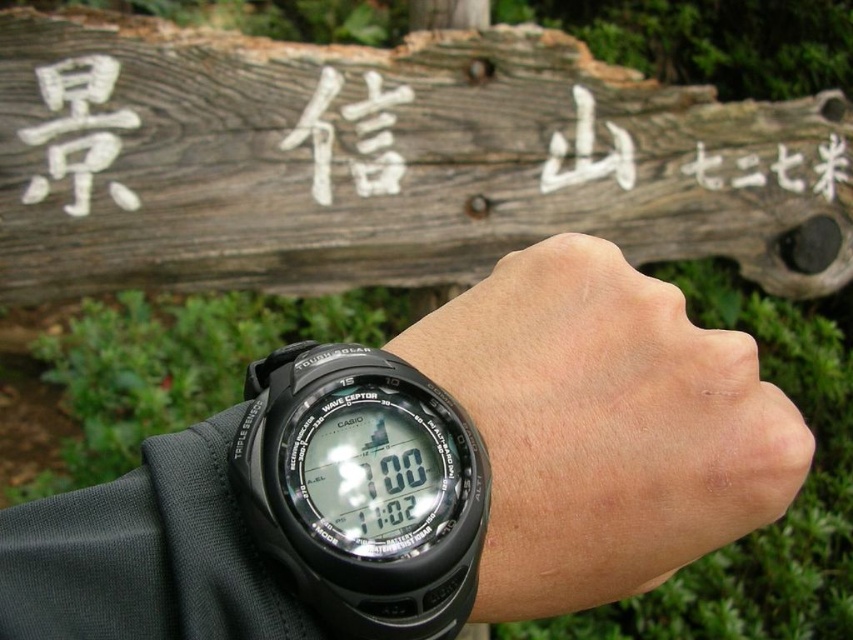
Question: Which point appears farthest from the camera in this image?

Choices:
 (A) (497, 307)
 (B) (444, 474)
 (C) (119, 120)

Answer: (C)

Question: Which of the following is the farthest from the observer?

Choices:
 (A) (123, 205)
 (B) (430, 208)
 (C) (335, 486)

Answer: (B)

Question: Which object appears farthest from the camera in this image?

Choices:
 (A) weathered wood sign at upper center
 (B) white wood sign at upper center

Answer: (B)

Question: From the image, what is the correct spatial relationship of weathered wood sign at upper center in relation to black plastic watch at center?

Choices:
 (A) below
 (B) above

Answer: (B)

Question: Does weathered wood sign at upper center have a greater width compared to white wood sign at upper center?

Choices:
 (A) no
 (B) yes

Answer: (B)

Question: Can you confirm if black rubber watch at lower center is positioned to the left of black plastic watch at center?

Choices:
 (A) yes
 (B) no

Answer: (B)